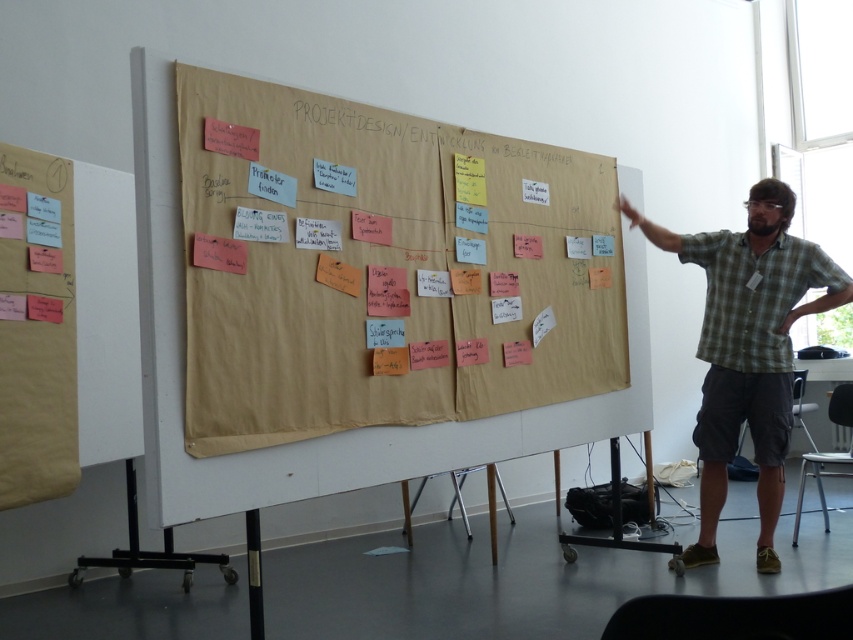
Looking at this image, who is more distant from viewer, (358,204) or (299,116)?

Positioned behind is point (358,204).

Looking at this image, is brown paper at center positioned at the back of white paper at center?

No, it is not.

Who is more forward, (457, 365) or (393, 124)?

Positioned in front is point (393, 124).

Find the location of `brown paper at center`. brown paper at center is located at coordinates (383, 269).

Which is below, green plaid shirt at right or white paper at center?

green plaid shirt at right is lower down.

Is point (643, 230) farther from camera compared to point (408, 134)?

Yes.

Is point (817, 276) positioned in front of point (328, 108)?

No, (817, 276) is further to viewer.

This screenshot has height=640, width=853. Identify the location of green plaid shirt at right. (747, 348).

Does point (525, 378) come farther from viewer compared to point (717, 419)?

No.

What do you see at coordinates (383, 269) in the screenshot? This screenshot has width=853, height=640. I see `brown paper at center` at bounding box center [383, 269].

At what (x,y) coordinates should I click in order to perform the action: click on brown paper at center. Please return your answer as a coordinate pair (x, y). The width and height of the screenshot is (853, 640). Looking at the image, I should click on (383, 269).